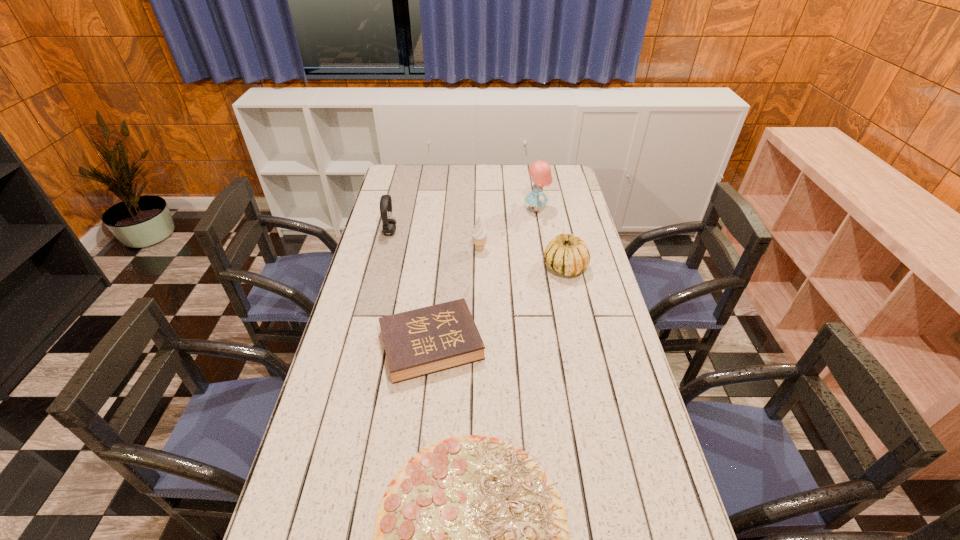
The width and height of the screenshot is (960, 540). In order to click on vacant space at the far left corner in this screenshot , I will do `click(400, 177)`.

Find the location of a particular element. This screenshot has height=540, width=960. free spot at the far right corner of the desktop is located at coordinates (563, 187).

Where is `free space between the headset and the hardback book`? The image size is (960, 540). free space between the headset and the hardback book is located at coordinates (411, 288).

Identify the location of vacant area that lies between the doll and the fifth tallest object. (484, 278).

I want to click on vacant area that lies between the doll and the leftmost object, so click(463, 221).

Locate an element on the screen. The image size is (960, 540). vacant area that lies between the icecream and the doll is located at coordinates (508, 230).

Image resolution: width=960 pixels, height=540 pixels. Find the location of `free spot between the hardback book and the gourd`. free spot between the hardback book and the gourd is located at coordinates (498, 306).

Identify the location of vacant space in between the icecream and the second shortest object. The width and height of the screenshot is (960, 540). (456, 298).

What are the coordinates of `free space between the gourd and the hardback book` in the screenshot? It's located at (498, 306).

I want to click on object that is the closest to the doll, so click(568, 254).